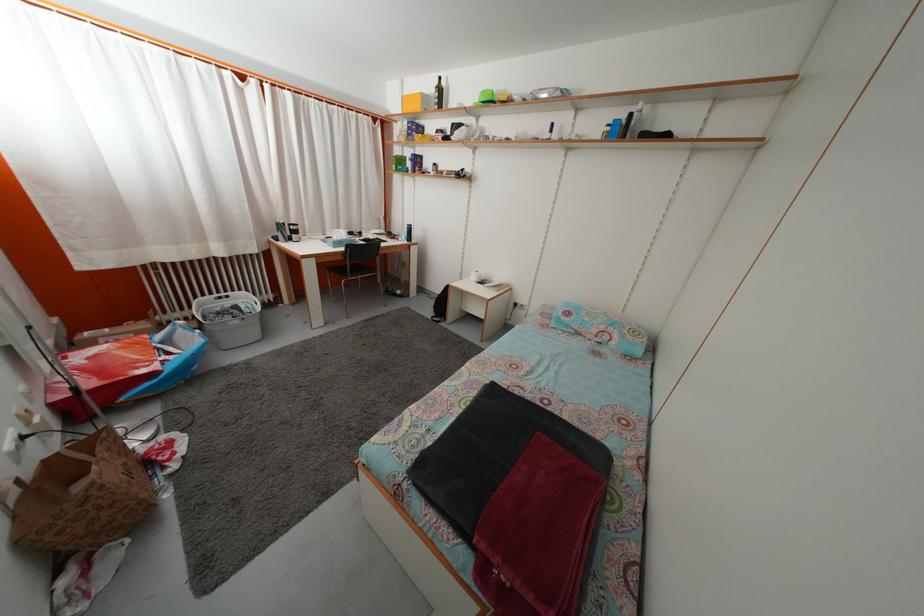
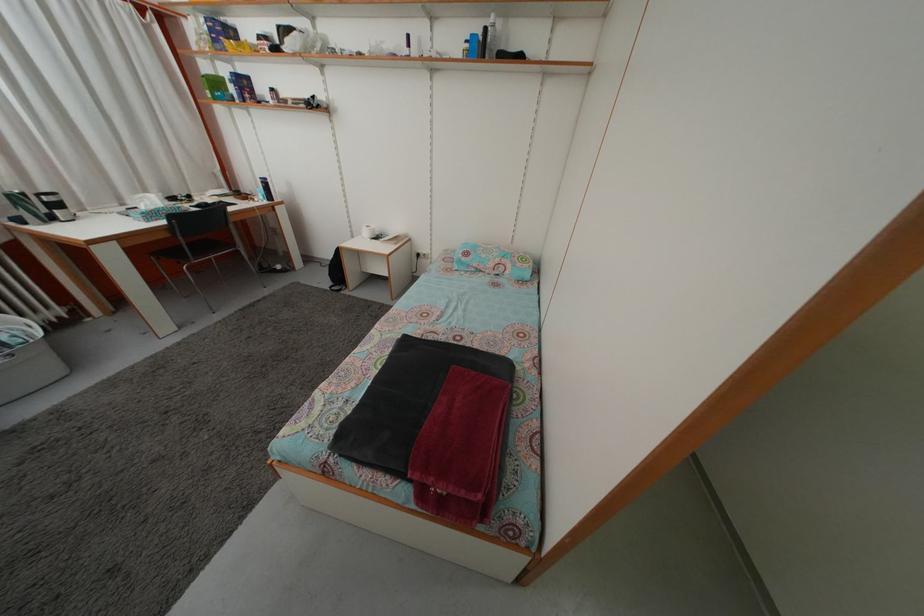
The point at (x=444, y=297) is marked in the first image. Where is the corresponding point in the second image?

(335, 262)